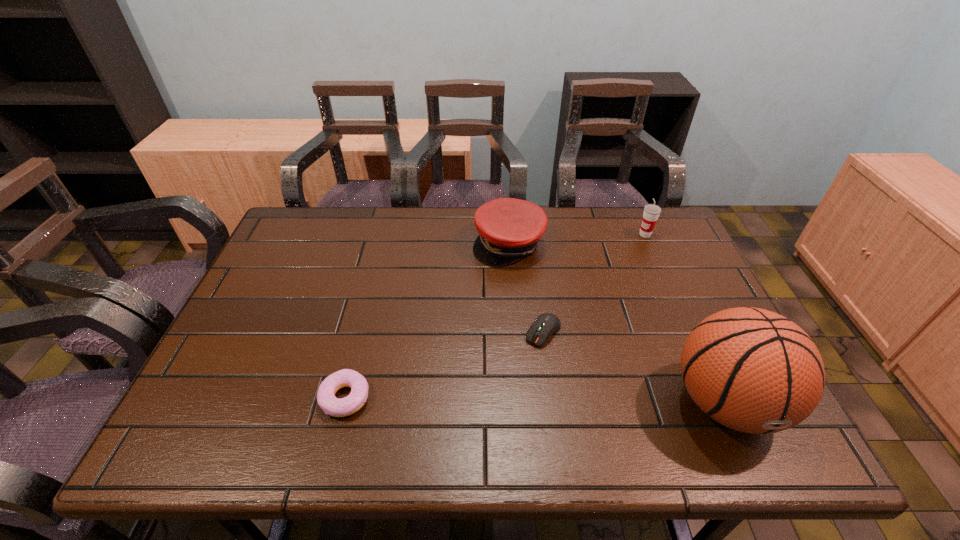
I want to click on object that is at the far right corner, so click(651, 212).

Identify the location of object positioned at the near right corner. (755, 371).

I want to click on vacant space at the far edge of the desktop, so click(383, 237).

I want to click on vacant space at the near edge of the desktop, so click(649, 412).

You are a GUI agent. You are given a task and a screenshot of the screen. Output one action in this format:
    pyautogui.click(x=<x>, y=<y>)
    Task: Click on the free space at the left edge
    
    Given the screenshot: What is the action you would take?
    pyautogui.click(x=289, y=287)

The image size is (960, 540). What are the coordinates of `free location at the right edge of the desktop` in the screenshot? It's located at (678, 346).

Image resolution: width=960 pixels, height=540 pixels. Find the location of `vacant area that lies between the doughnut and the cap`. vacant area that lies between the doughnut and the cap is located at coordinates (427, 320).

At what (x,y) coordinates should I click in order to perform the action: click on vacant space that is in between the third farthest object and the leftmost object. Please return your answer as a coordinate pair (x, y). Looking at the image, I should click on (444, 364).

Where is `free space between the third nearest object and the leftmost object`? Image resolution: width=960 pixels, height=540 pixels. free space between the third nearest object and the leftmost object is located at coordinates (444, 364).

In order to click on empty space between the tallest object and the leftmost object in this screenshot , I will do `click(535, 400)`.